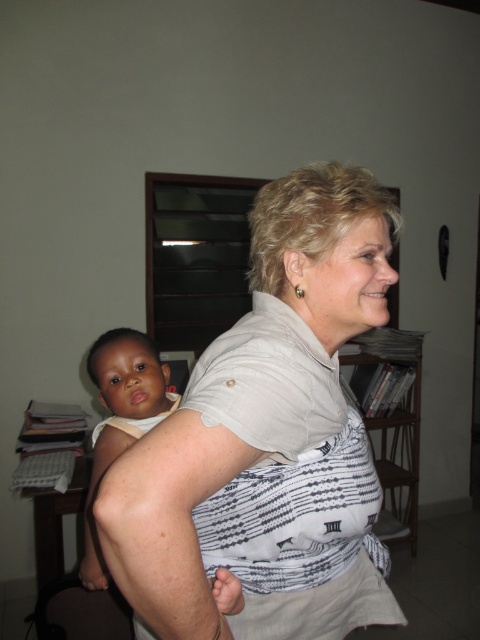
You are a photographer trying to capture a clear shot of the white textured shirt at center and the light brown skin baby at center. Since you want both subjects to be in focus, which one should you adjust your camera focus on first considering their sizes?

The white textured shirt at center has a larger width than the light brown skin baby at center, so you should focus on the white textured shirt at center first to ensure both are in focus.

Please use the coordinates provided to identify which object is located at point (252, 397) in the image. The available objects are the adult woman and the young child.

The white textured shirt at center is located at point (252, 397), so the object at that coordinate is the adult woman wearing the white textured shirt at center.